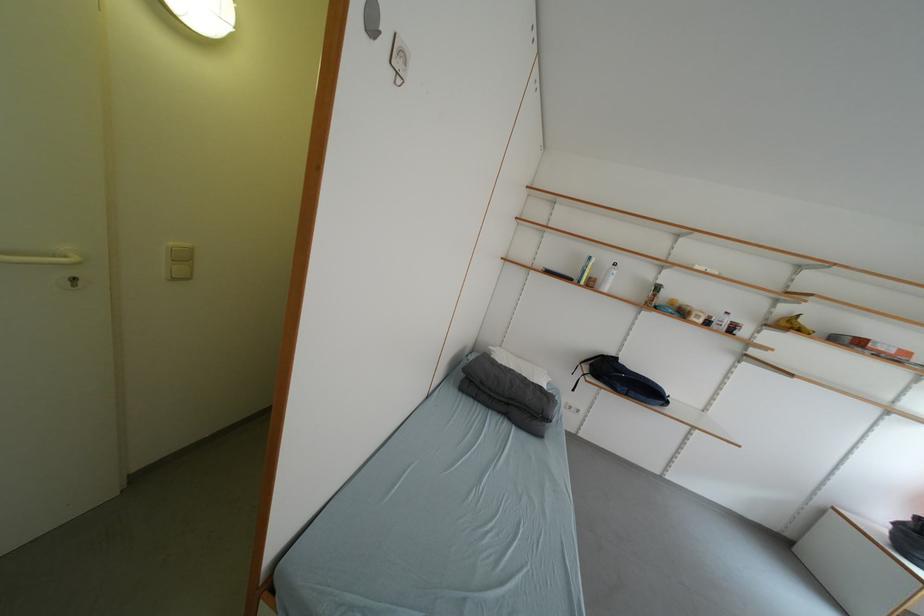
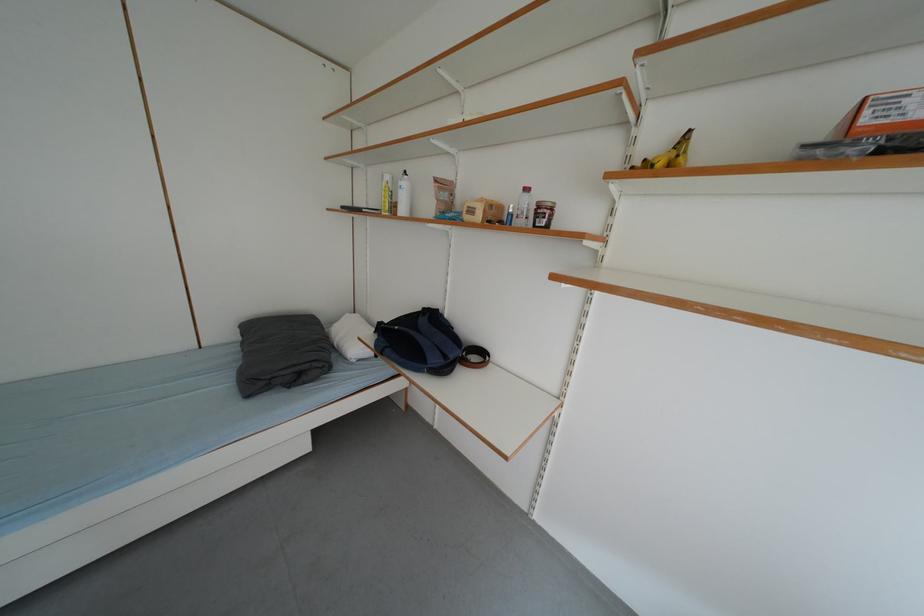
Where in the second image is the point corresponding to point (640, 395) from the first image?

(396, 354)